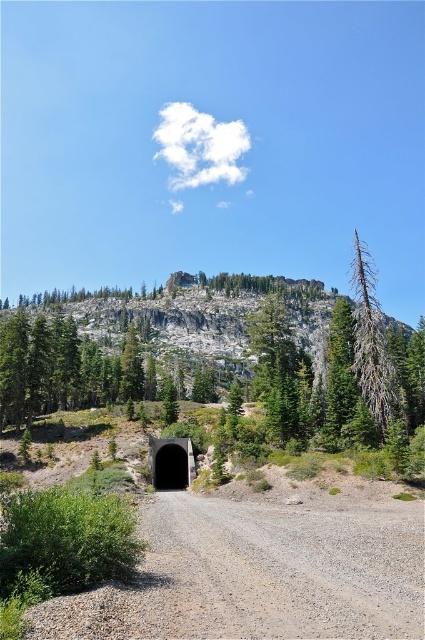
Question: Does gray rocky mountain at upper center have a smaller size compared to grayish-brown bark tree at right?

Choices:
 (A) no
 (B) yes

Answer: (A)

Question: Can you confirm if gray gravel road at lower center is thinner than gray rocky mountain at upper center?

Choices:
 (A) no
 (B) yes

Answer: (B)

Question: Which is farther from the gray gravel road at lower center?

Choices:
 (A) black concrete tunnel at center
 (B) grayish-brown bark tree at right

Answer: (B)

Question: Which of the following is the closest to the observer?

Choices:
 (A) (314, 536)
 (B) (198, 333)
 (C) (183, 481)
 (D) (384, 349)

Answer: (A)

Question: From the image, what is the correct spatial relationship of grayish-brown bark tree at right in relation to black concrete tunnel at center?

Choices:
 (A) left
 (B) right

Answer: (B)

Question: Based on their relative distances, which object is farther from the black concrete tunnel at center?

Choices:
 (A) gray rocky mountain at upper center
 (B) gray gravel road at lower center
 (C) grayish-brown bark tree at right

Answer: (A)